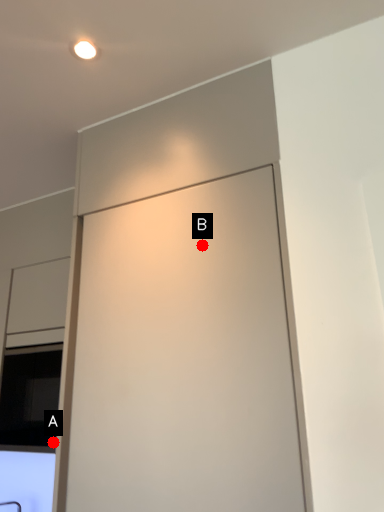
Question: Two points are circled on the image, labeled by A and B beside each circle. Which point appears closest to the camera in this image?

Choices:
 (A) A is closer
 (B) B is closer

Answer: (B)